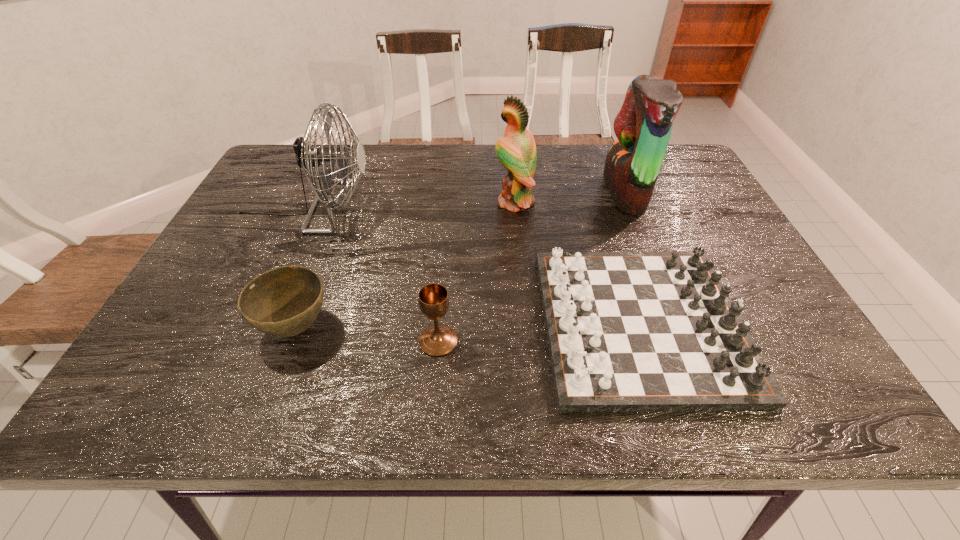
The width and height of the screenshot is (960, 540). In order to click on object that is at the left edge in this screenshot , I will do `click(307, 158)`.

Locate an element on the screen. object that is positioned at the right edge is located at coordinates (627, 331).

Where is `object situated at the far left corner`? Image resolution: width=960 pixels, height=540 pixels. object situated at the far left corner is located at coordinates (307, 158).

Identify the location of object that is at the near right corner. (627, 331).

Find the location of a particular element. This screenshot has width=960, height=540. vacant area at the far edge of the desktop is located at coordinates (456, 161).

At what (x,y) coordinates should I click in order to perform the action: click on free space at the near edge of the desktop. Please return your answer as a coordinate pair (x, y). Image resolution: width=960 pixels, height=540 pixels. Looking at the image, I should click on (258, 403).

Locate an element on the screen. The width and height of the screenshot is (960, 540). free space at the left edge of the desktop is located at coordinates (241, 281).

The height and width of the screenshot is (540, 960). What are the coordinates of `vacant position at the right edge of the desktop` in the screenshot? It's located at (702, 219).

Locate an element on the screen. This screenshot has height=540, width=960. free spot between the third shortest object and the left parrot is located at coordinates (476, 272).

At what (x,y) coordinates should I click in order to perform the action: click on free space between the fourth object from right to left and the chessboard. Please return your answer as a coordinate pair (x, y). Looking at the image, I should click on (540, 332).